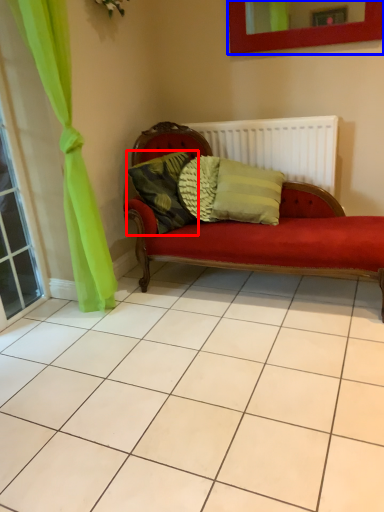
Question: Which object appears farthest to the camera in this image, pillow (highlighted by a red box) or picture frame (highlighted by a blue box)?

Choices:
 (A) pillow
 (B) picture frame

Answer: (A)